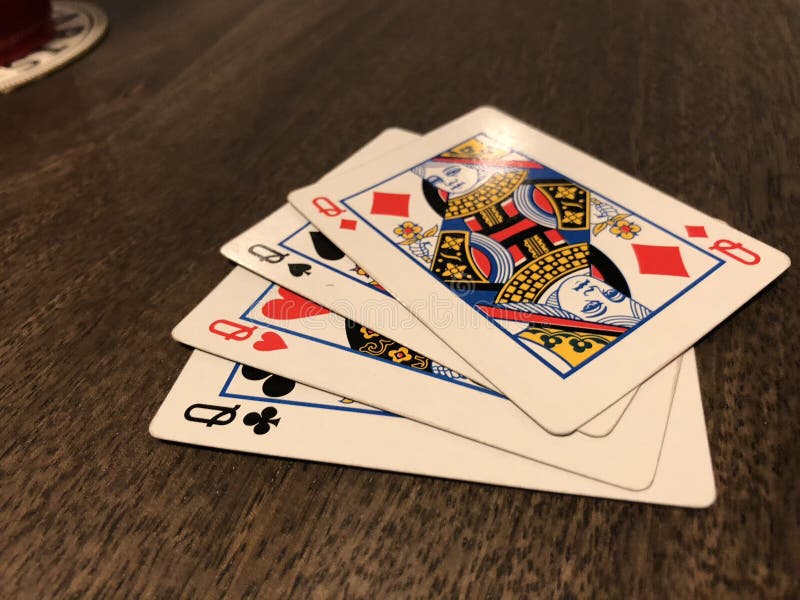
Locate an element on the screen. This screenshot has width=800, height=600. drink coaster is located at coordinates (20, 70), (78, 38).